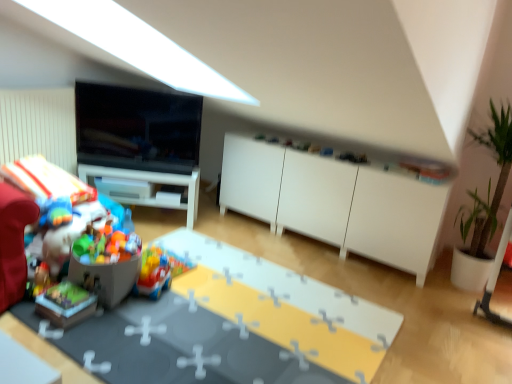
Question: Is wooden block at lower left, arranged as the 2th toy when viewed from the left, positioned far away from translucent plastic toy car at center, marked as the 4th toy in a left-to-right arrangement?

Choices:
 (A) yes
 (B) no

Answer: (B)

Question: Does wooden block at lower left, the 3th toy positioned from the right, lie in front of translucent plastic toy car at center, marked as the 4th toy in a left-to-right arrangement?

Choices:
 (A) yes
 (B) no

Answer: (A)

Question: Can you confirm if wooden block at lower left, the 3th toy positioned from the right, is thinner than translucent plastic toy car at center, which is the 1th toy from right to left?

Choices:
 (A) yes
 (B) no

Answer: (B)

Question: Does wooden block at lower left, the 3th toy positioned from the right, have a lesser height compared to translucent plastic toy car at center, which is the 1th toy from right to left?

Choices:
 (A) yes
 (B) no

Answer: (A)

Question: Could you tell me if wooden block at lower left, the 3th toy positioned from the right, is facing translucent plastic toy car at center, marked as the 4th toy in a left-to-right arrangement?

Choices:
 (A) no
 (B) yes

Answer: (A)

Question: Does wooden block at lower left, the 3th toy positioned from the right, have a greater height compared to translucent plastic toy car at center, which is the 1th toy from right to left?

Choices:
 (A) yes
 (B) no

Answer: (B)

Question: Does green leafy plant in pot at right have a lesser width compared to matte black tv at upper left?

Choices:
 (A) no
 (B) yes

Answer: (A)

Question: Does green leafy plant in pot at right appear on the right side of matte black tv at upper left?

Choices:
 (A) no
 (B) yes

Answer: (B)

Question: Is green leafy plant in pot at right smaller than matte black tv at upper left?

Choices:
 (A) yes
 (B) no

Answer: (B)

Question: Can you confirm if green leafy plant in pot at right is positioned to the left of matte black tv at upper left?

Choices:
 (A) yes
 (B) no

Answer: (B)

Question: Can you confirm if green leafy plant in pot at right is wider than matte black tv at upper left?

Choices:
 (A) yes
 (B) no

Answer: (A)

Question: Is the depth of green leafy plant in pot at right greater than that of matte black tv at upper left?

Choices:
 (A) no
 (B) yes

Answer: (A)

Question: From the image's perspective, is matte plastic table at lower left on green leafy plant in pot at right?

Choices:
 (A) no
 (B) yes

Answer: (A)